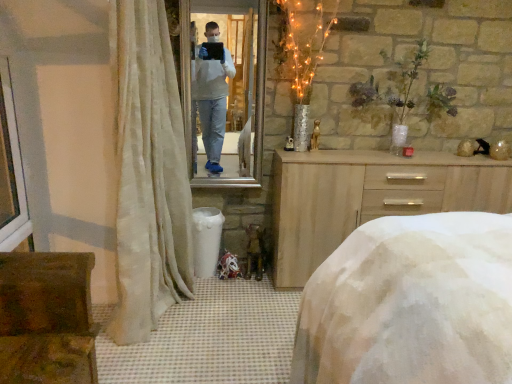
Question: Is rustic wooden chest at lower left oriented towards white textured bed at center?

Choices:
 (A) yes
 (B) no

Answer: (A)

Question: Is rustic wooden chest at lower left bigger than white textured bed at center?

Choices:
 (A) yes
 (B) no

Answer: (B)

Question: Can white textured bed at center be found inside rustic wooden chest at lower left?

Choices:
 (A) no
 (B) yes

Answer: (A)

Question: Is rustic wooden chest at lower left wider than white textured bed at center?

Choices:
 (A) no
 (B) yes

Answer: (A)

Question: Does rustic wooden chest at lower left appear on the right side of white textured bed at center?

Choices:
 (A) no
 (B) yes

Answer: (A)

Question: Is rustic wooden chest at lower left thinner than white textured bed at center?

Choices:
 (A) yes
 (B) no

Answer: (A)

Question: Is rustic wooden chest at lower left located within sheer beige curtain at left?

Choices:
 (A) no
 (B) yes

Answer: (A)

Question: From a real-world perspective, is sheer beige curtain at left positioned over rustic wooden chest at lower left based on gravity?

Choices:
 (A) no
 (B) yes

Answer: (B)

Question: Is sheer beige curtain at left placed right next to rustic wooden chest at lower left?

Choices:
 (A) no
 (B) yes

Answer: (A)

Question: From the image's perspective, does sheer beige curtain at left appear lower than rustic wooden chest at lower left?

Choices:
 (A) yes
 (B) no

Answer: (B)

Question: Does sheer beige curtain at left have a greater height compared to rustic wooden chest at lower left?

Choices:
 (A) no
 (B) yes

Answer: (B)

Question: Is sheer beige curtain at left bigger than rustic wooden chest at lower left?

Choices:
 (A) no
 (B) yes

Answer: (B)

Question: From a real-world perspective, is metallic reflective mirror at center below white plastic window frame at left?

Choices:
 (A) yes
 (B) no

Answer: (B)